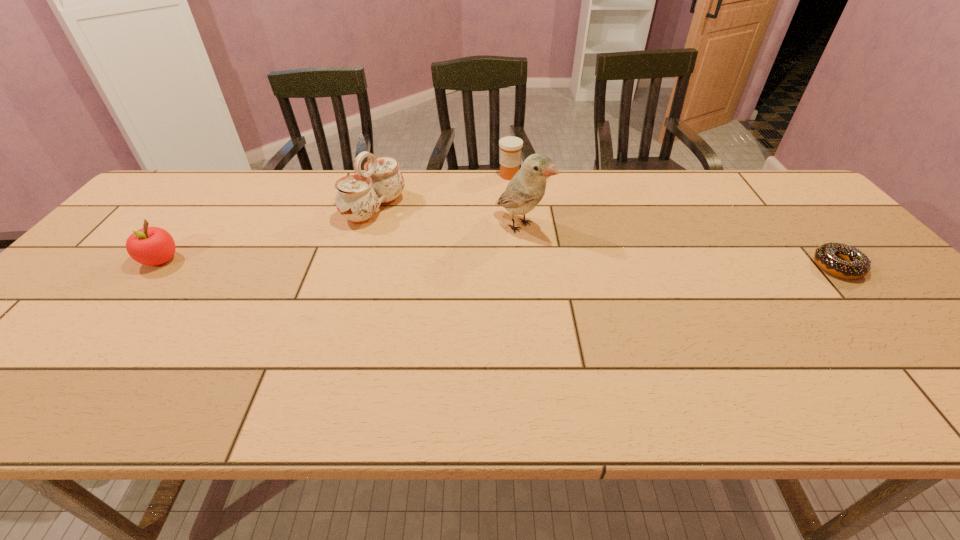
I want to click on the leftmost object, so click(151, 246).

Image resolution: width=960 pixels, height=540 pixels. In order to click on doughnut in this screenshot , I will do `click(840, 260)`.

Find the location of a particular element. This screenshot has height=540, width=960. the shortest object is located at coordinates (840, 260).

I want to click on the second object from left to right, so click(358, 197).

In order to click on chinaware in this screenshot , I will do pos(358,197).

Identify the location of the tallest object. This screenshot has width=960, height=540. (526, 189).

Where is `the farthest object`? This screenshot has height=540, width=960. the farthest object is located at coordinates (510, 147).

Where is `vacant area located on the right of the leftmost object`? vacant area located on the right of the leftmost object is located at coordinates (215, 260).

Where is `vacant region located 0.210m on the front of the doughnut`? The width and height of the screenshot is (960, 540). vacant region located 0.210m on the front of the doughnut is located at coordinates (912, 351).

Find the location of a particular element. vacant space situated by the handle of the chinaware is located at coordinates (470, 247).